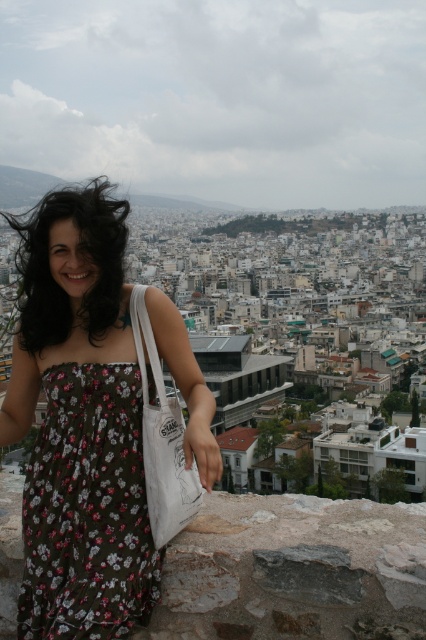
Question: Which is nearer to the white canvas tote at center?

Choices:
 (A) floral print fabric dress at center
 (B) dark brown silky hair at left
 (C) floral cotton dress at center

Answer: (C)

Question: Can you confirm if floral cotton dress at center is positioned above dark brown silky hair at left?

Choices:
 (A) yes
 (B) no

Answer: (B)

Question: Does floral cotton dress at center have a larger size compared to dark brown silky hair at left?

Choices:
 (A) no
 (B) yes

Answer: (A)

Question: Which point is closer to the camera taking this photo?

Choices:
 (A) (39, 339)
 (B) (127, 518)
 (C) (198, 492)

Answer: (B)

Question: Where is floral cotton dress at center located in relation to dark brown silky hair at left in the image?

Choices:
 (A) right
 (B) left

Answer: (A)

Question: Among these points, which one is nearest to the camera?

Choices:
 (A) (203, 394)
 (B) (71, 316)

Answer: (A)